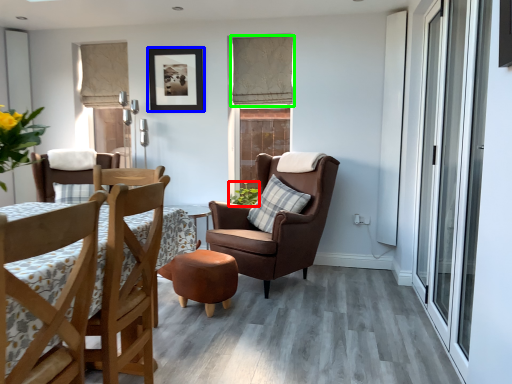
Question: Based on their relative distances, which object is nearer to houseplant (highlighted by a red box)? Choose from picture frame (highlighted by a blue box) and curtain (highlighted by a green box).

Choices:
 (A) picture frame
 (B) curtain

Answer: (B)